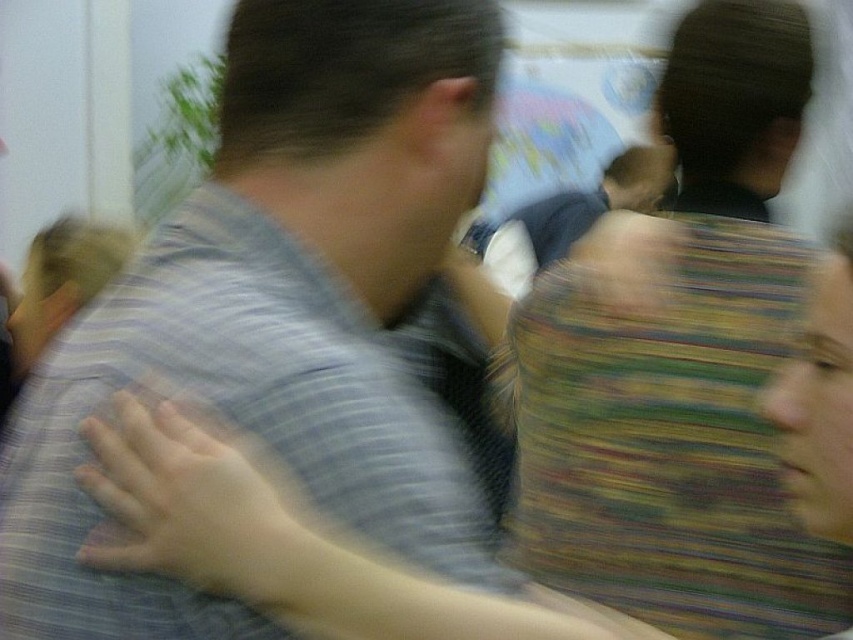
You are organizing a clothing donation drive and need to determine which item takes up more space. Given the image, which object is wider between the gray striped shirt at center and the striped fabric bag at center?

The gray striped shirt at center is wider than the striped fabric bag at center according to the description.